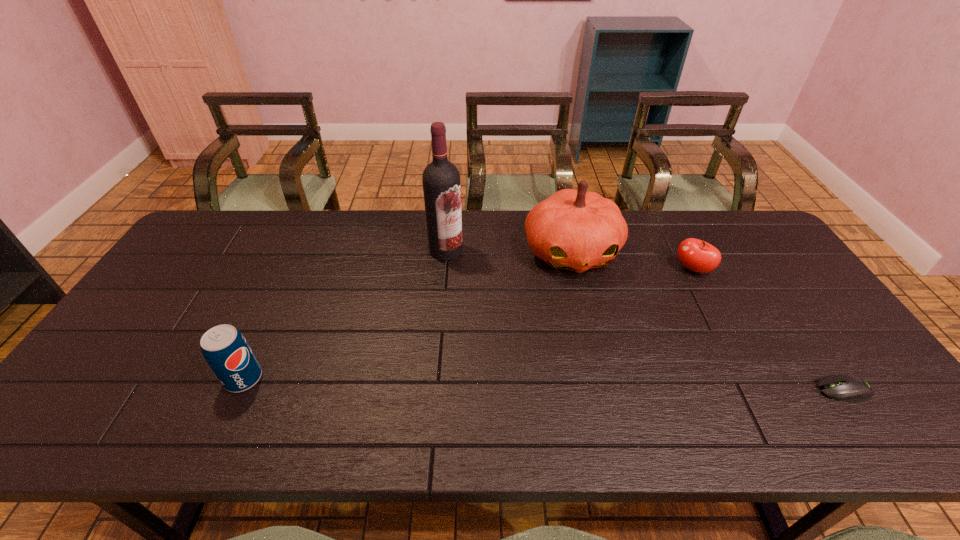
At what (x,y) coordinates should I click in order to perform the action: click on the third tallest object. Please return your answer as a coordinate pair (x, y). This screenshot has width=960, height=540. Looking at the image, I should click on (225, 349).

The image size is (960, 540). Identify the location of the leftmost object. point(225,349).

You are a GUI agent. You are given a task and a screenshot of the screen. Output one action in this format:
    pyautogui.click(x=<x>, y=<y>)
    Task: Click on the rightmost object
    The width and height of the screenshot is (960, 540).
    Given the screenshot: What is the action you would take?
    pyautogui.click(x=849, y=388)

Where is `the shortest object`? This screenshot has height=540, width=960. the shortest object is located at coordinates (849, 388).

The height and width of the screenshot is (540, 960). Find the location of `the tallest object`. the tallest object is located at coordinates (441, 179).

You are a GUI agent. You are given a task and a screenshot of the screen. Output one action in this format:
    pyautogui.click(x=<x>, y=<y>)
    Task: Click on the wine bottle
    
    Given the screenshot: What is the action you would take?
    pyautogui.click(x=441, y=179)

Locate an element on the screen. The image size is (960, 540). pumpkin is located at coordinates (576, 230).

This screenshot has width=960, height=540. In order to click on the fourth shortest object in this screenshot , I will do `click(576, 230)`.

At what (x,y) coordinates should I click in order to perform the action: click on the second object from right to left. Please return your answer as a coordinate pair (x, y). The image size is (960, 540). Looking at the image, I should click on (696, 255).

At what (x,y) coordinates should I click in order to perform the action: click on apple. Please return your answer as a coordinate pair (x, y). The width and height of the screenshot is (960, 540). Looking at the image, I should click on (696, 255).